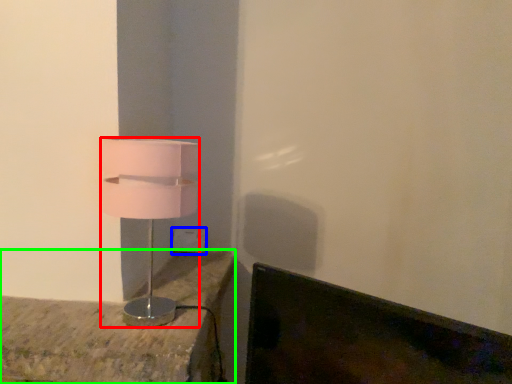
Question: Which object is the closest to the lamp (highlighted by a red box)? Choose among these: electric outlet (highlighted by a blue box) or furniture (highlighted by a green box).

Choices:
 (A) electric outlet
 (B) furniture

Answer: (B)